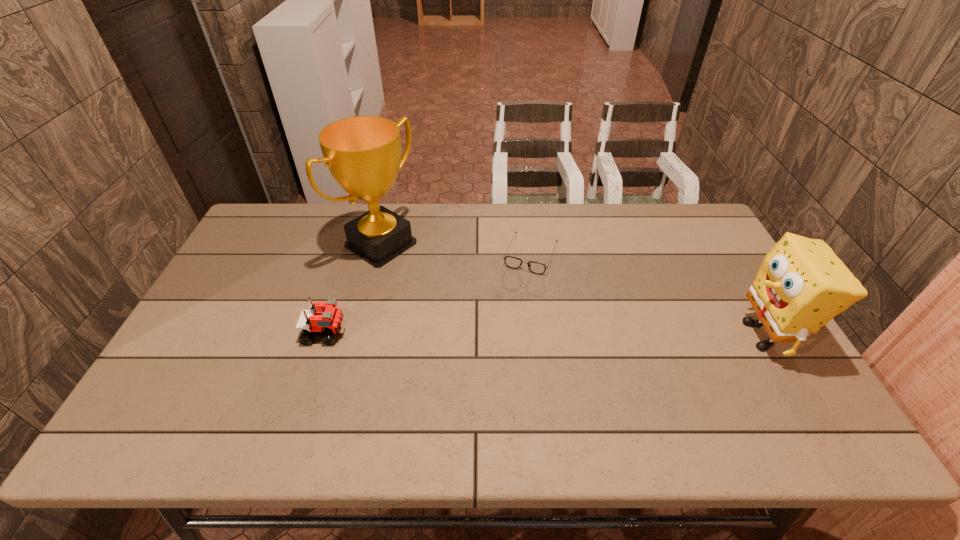
Identify the location of vacant point located between the rightmost object and the second shortest object. The image size is (960, 540). (544, 334).

Where is `vacant region between the third object from left to right and the tallest object`? vacant region between the third object from left to right and the tallest object is located at coordinates (456, 250).

Choose which object is the nearest neighbor to the tallest object. Please provide its 2D coordinates. Your answer should be formatted as a tuple, i.e. [(x, y)], where the tuple contains the x and y coordinates of a point satisfying the conditions above.

[(328, 320)]

Identify which object is the closest to the tallest object. Please provide its 2D coordinates. Your answer should be formatted as a tuple, i.e. [(x, y)], where the tuple contains the x and y coordinates of a point satisfying the conditions above.

[(328, 320)]

At what (x,y) coordinates should I click in order to perform the action: click on vacant space that satisfies the following two spatial constraints: 1. on the front side of the third object from left to right; 2. on the left side of the tallest object. Please return your answer as a coordinate pair (x, y). The width and height of the screenshot is (960, 540). Looking at the image, I should click on (378, 255).

Find the location of a particular element. free region that satisfies the following two spatial constraints: 1. on the front side of the award; 2. on the face of the second tallest object is located at coordinates (358, 335).

This screenshot has height=540, width=960. I want to click on free location that satisfies the following two spatial constraints: 1. on the front side of the second object from right to left; 2. on the face of the third shortest object, so click(540, 335).